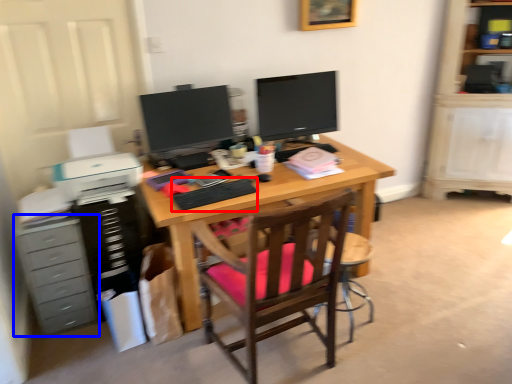
Question: Among these objects, which one is farthest to the camera, computer keyboard (highlighted by a red box) or chest of drawers (highlighted by a blue box)?

Choices:
 (A) computer keyboard
 (B) chest of drawers

Answer: (B)